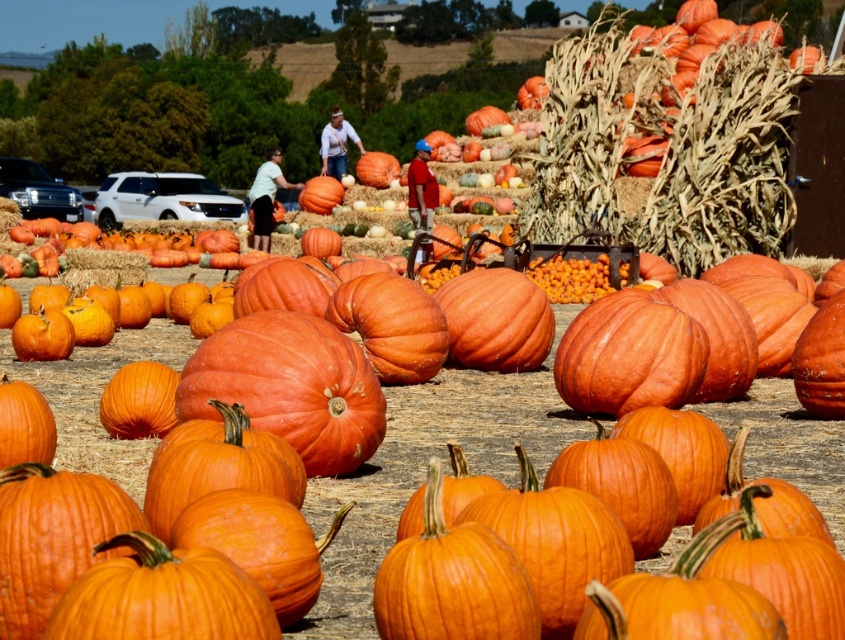
Which of these two, textured straw bale at upper right or orange matte pumpkin at center, stands taller?

Standing taller between the two is textured straw bale at upper right.

From the picture: Between textured straw bale at upper right and orange matte pumpkin at center, which one appears on the right side from the viewer's perspective?

Positioned to the right is textured straw bale at upper right.

Where is `textured straw bale at upper right`? textured straw bale at upper right is located at coordinates (668, 148).

At what (x,y) coordinates should I click in order to perform the action: click on textured straw bale at upper right. Please return your answer as a coordinate pair (x, y). The image size is (845, 640). Looking at the image, I should click on (668, 148).

Is straw bale at center taller than orange matte hay at lower left?

No.

Find the location of a particular element. This screenshot has height=640, width=845. straw bale at center is located at coordinates (102, 268).

What are the coordinates of `straw bale at center` in the screenshot? It's located at (102, 268).

Can you confirm if textured straw bale at upper right is positioned below straw bale at center?

No, textured straw bale at upper right is not below straw bale at center.

Is textured straw bale at upper right shorter than straw bale at center?

No, textured straw bale at upper right is not shorter than straw bale at center.

Which is behind, point (773, 241) or point (71, 260)?

The point (773, 241) is behind.

Locate an element on the screen. This screenshot has width=845, height=640. textured straw bale at upper right is located at coordinates (668, 148).